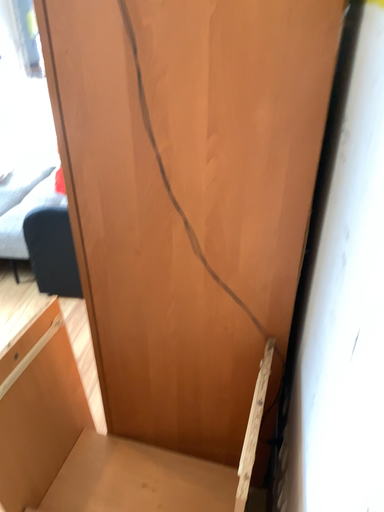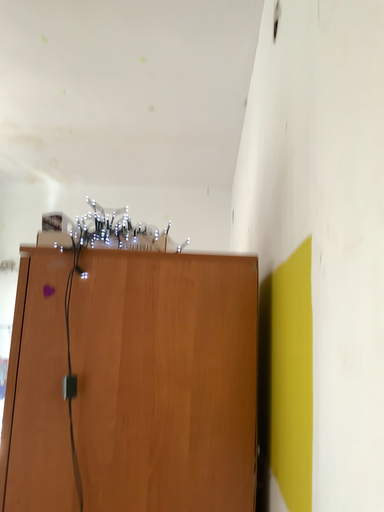
Question: How did the camera likely rotate when shooting the video?

Choices:
 (A) rotated downward
 (B) rotated upward

Answer: (B)